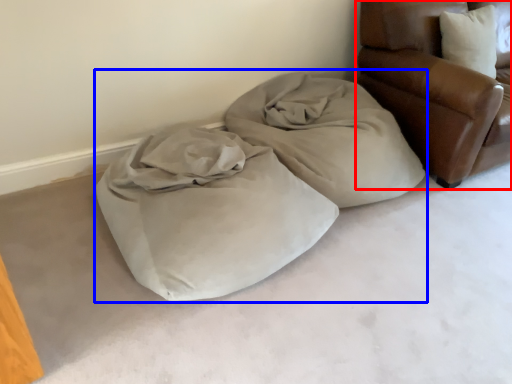
Question: Which of the following is the farthest to the observer, furniture (highlighted by a red box) or bed (highlighted by a blue box)?

Choices:
 (A) furniture
 (B) bed

Answer: (A)